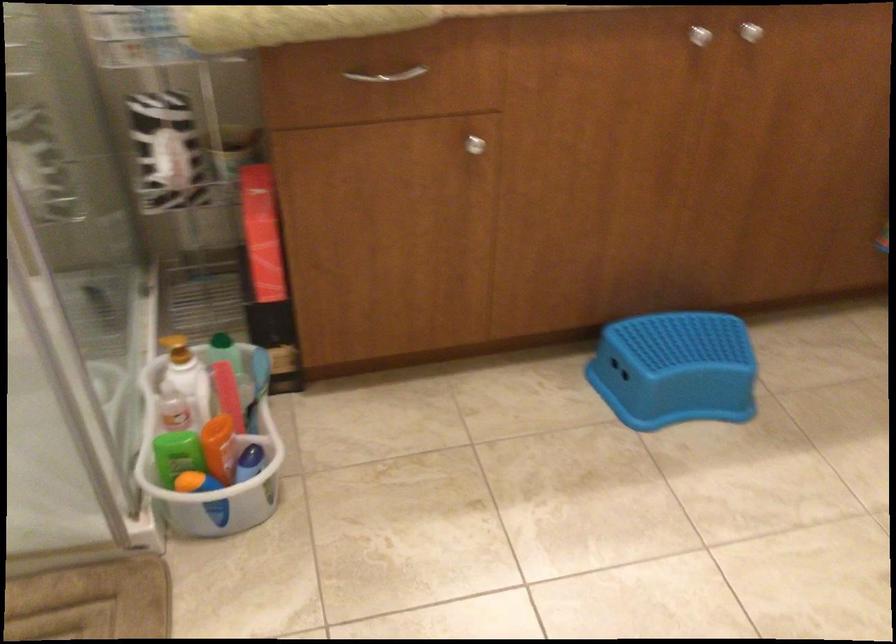
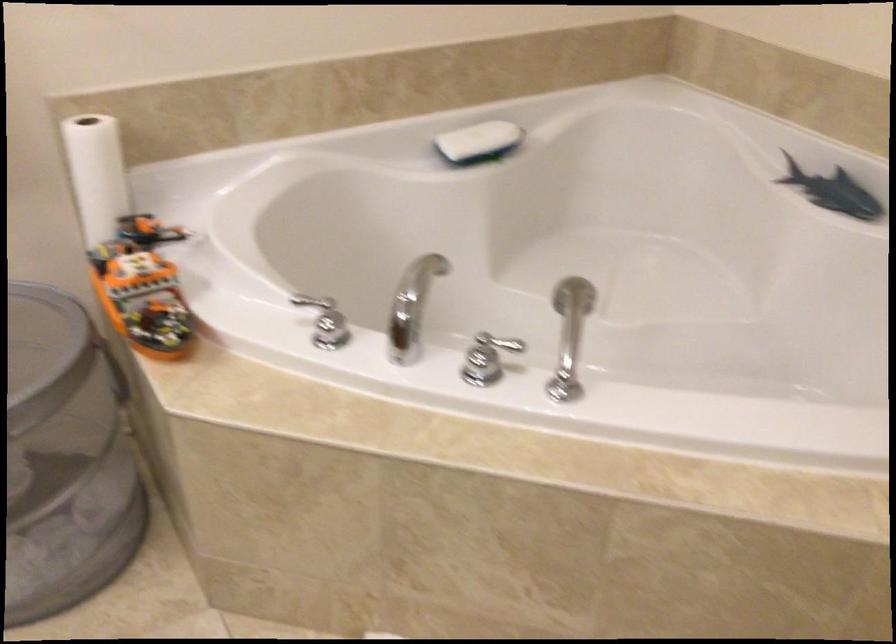
Based on the continuous images, in which direction is the camera rotating?

The camera's rotation is toward right-down.